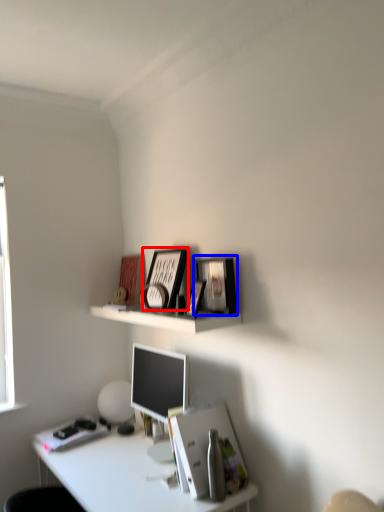
Question: Which object appears closest to the camera in this image, picture frame (highlighted by a red box) or picture frame (highlighted by a blue box)?

Choices:
 (A) picture frame
 (B) picture frame

Answer: (B)